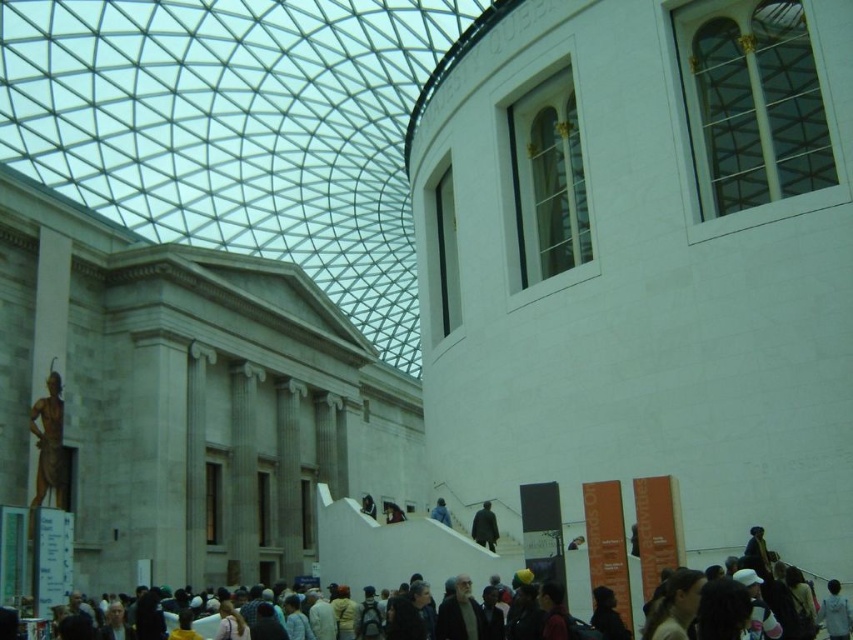
In the scene shown: You are an interior designer planning to place a new artwork in the museum. The artwork requires a space wider than the gold metallic statue at left. Can the dark blue fabric at center accommodate it?

The gold metallic statue at left is narrower than the dark blue fabric at center, so the dark blue fabric at center can accommodate the artwork requiring a wider space.